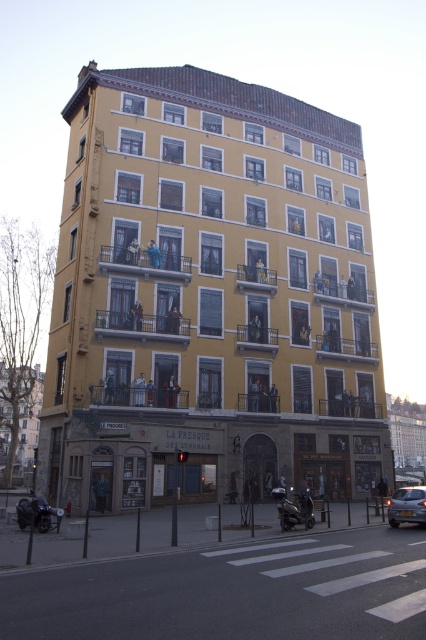
You are a delivery person needing to park your vehicle in front of the building. The parking spot available is exactly 1.8 meters wide. You have to choose between the metallic silver car at lower right and the shiny black motorcycle at lower center to park. Which vehicle can fit into the parking spot?

The metallic silver car at lower right has a lesser width compared to the shiny black motorcycle at lower center. Since the parking spot is 1.8 meters wide, the metallic silver car at lower right is narrower and can fit into the parking spot, while the shiny black motorcycle at lower center may be too wide.

You are a photographer wanting to capture both shiny black motorcycle at lower left and shiny black motorcycle at lower center in a single frame. Since you want them to appear balanced, which motorcycle should you move closer to, and which one farther away?

To balance the composition, move closer to the shiny black motorcycle at lower center and position the shiny black motorcycle at lower left farther away since the motorcycle at lower left is bigger and would dominate the frame otherwise.

You are standing in front of the building and want to touch both points on the facade. Which point should you reach for first, the point at coordinates (391, 513) or the point at (57, 518)?

You should reach for the point at coordinates (391, 513) first because it is closer to you than the point at (57, 518).